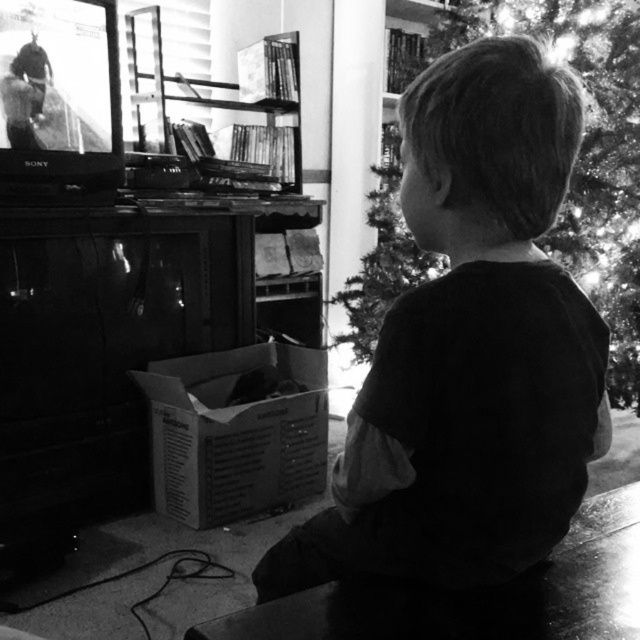
You are a photographer trying to capture a photo of the dark cotton shirt at center and the shiny metallic tree at center. Which object should you focus on first if you want to ensure both are in focus?

The dark cotton shirt at center is shorter than the shiny metallic tree at center, so you should focus on the shiny metallic tree at center first to ensure both are in focus.

You are a photographer adjusting your camera settings in this scene. You want to focus on the shiny metallic tree at center without blurring the dark cotton shirt at center. Is this possible given their positions?

The dark cotton shirt at center is closer to the viewer than the shiny metallic tree at center, so focusing on both simultaneously may result in one being out of focus. Adjusting the aperture for a larger depth of field might help capture both in focus, but it depends on the camera settings available.